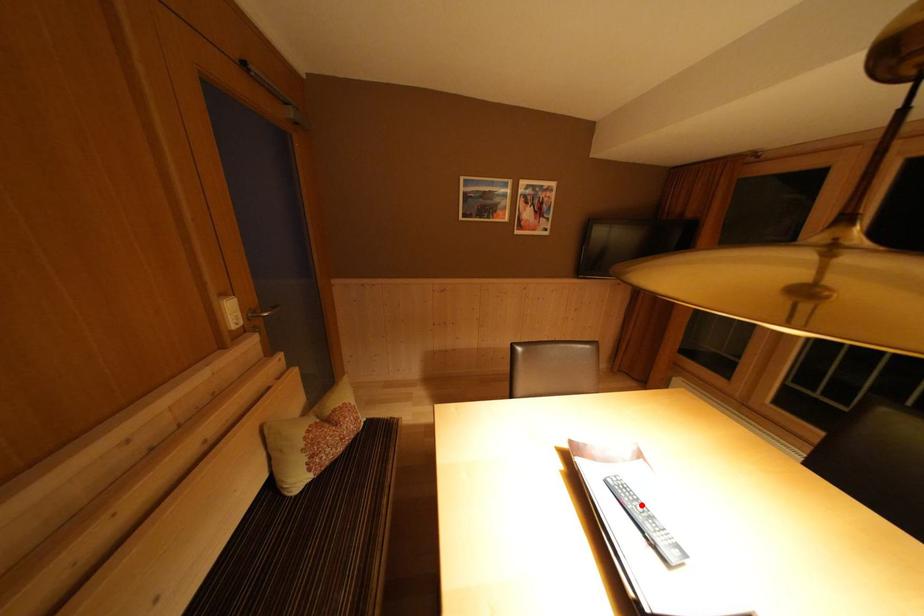
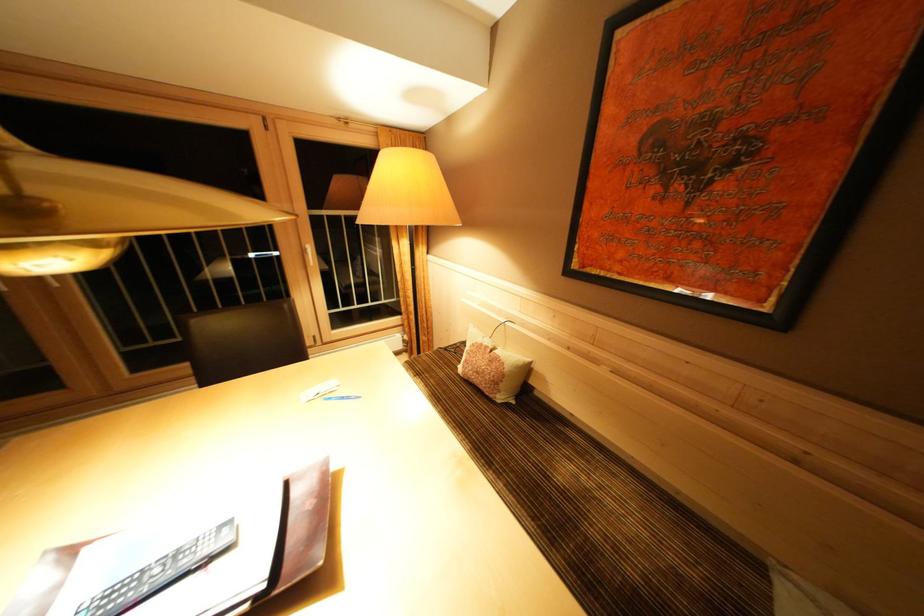
In the second image, find the point that corresponds to the highlighted location in the first image.

(147, 584)